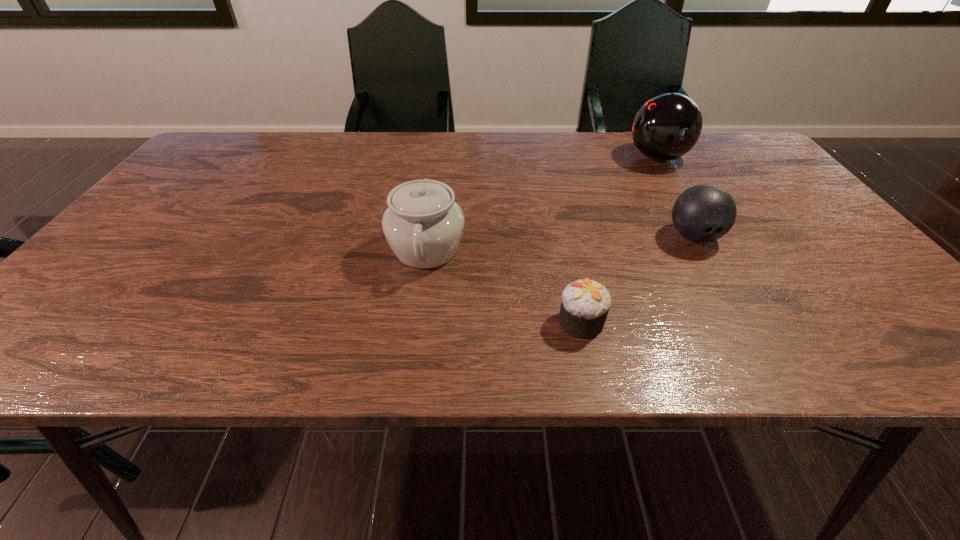
The height and width of the screenshot is (540, 960). I want to click on the farthest object, so click(x=667, y=126).

Where is `the farther bowling ball`? the farther bowling ball is located at coordinates (667, 126).

Locate an element on the screen. This screenshot has width=960, height=540. chinaware is located at coordinates (423, 225).

At what (x,y) coordinates should I click in order to perform the action: click on the third shortest object. Please return your answer as a coordinate pair (x, y). Looking at the image, I should click on (423, 225).

At what (x,y) coordinates should I click in order to perform the action: click on the nearer bowling ball. Please return your answer as a coordinate pair (x, y). Looking at the image, I should click on click(x=703, y=213).

This screenshot has height=540, width=960. I want to click on the second shortest object, so click(x=703, y=213).

Where is `the nearest object`? The width and height of the screenshot is (960, 540). the nearest object is located at coordinates (585, 304).

Where is `the shortest object`? This screenshot has width=960, height=540. the shortest object is located at coordinates (585, 304).

This screenshot has width=960, height=540. Find the location of `free region located 0.340m on the surface of the farther bowling ball near the finger holes`. free region located 0.340m on the surface of the farther bowling ball near the finger holes is located at coordinates (511, 158).

In order to click on free region located on the surface of the farther bowling ball near the finger holes in this screenshot , I will do `click(508, 158)`.